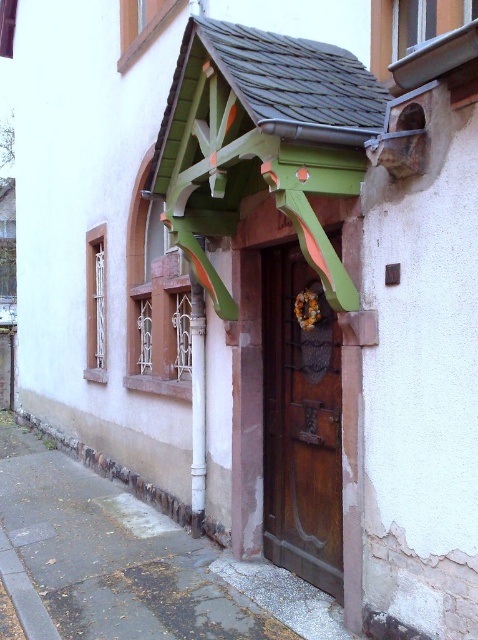
You are a delivery person carrying a package that is 1.2 meters long. You need to pass through the entrance under the decorative overhang. Can you fit through the space between the brown wooden door at center and the white painted wood at center without tilting the package?

The distance between the brown wooden door at center and the white painted wood at center is 1.06 meters. Since the package is 1.2 meters long, it is longer than the available space. Therefore, you cannot fit through the space without tilting the package.